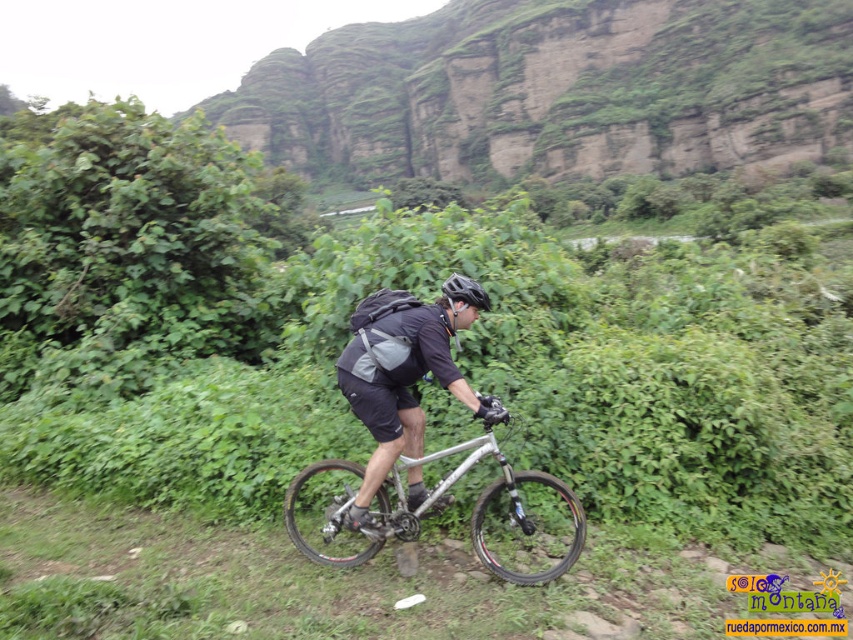
You are a hiker planning to take a photo of the cyclist wearing the black matte helmet at center. To ensure the green mossy rock at upper center doesn not block the view of the helmet, where should you position yourself relative to the cyclist?

The green mossy rock at upper center is positioned over the black matte helmet at center. To avoid blocking the view of the helmet, you should position yourself below the cyclist so the rock is out of the frame or adjust your angle to ensure the helmet is visible beneath the rock.

You are a hiker planning to take a photo of the silver metallic bicycle at center from the green leafy vegetation at center. Can you do this without moving your position?

The green leafy vegetation at center is located above the silver metallic bicycle at center, so yes, you can take the photo without moving your position as the vegetation is above the bicycle.

You are a hiker trying to navigate the steep cliffs in the background. You spot two reference points marked as point 1 at coordinates (537,483) and point 2 at coordinates (485,304). Which point is closer to your current position?

Point 1 at coordinates (537,483) is closer to your current position because it is further to the viewer than point 2 at coordinates (485,304).